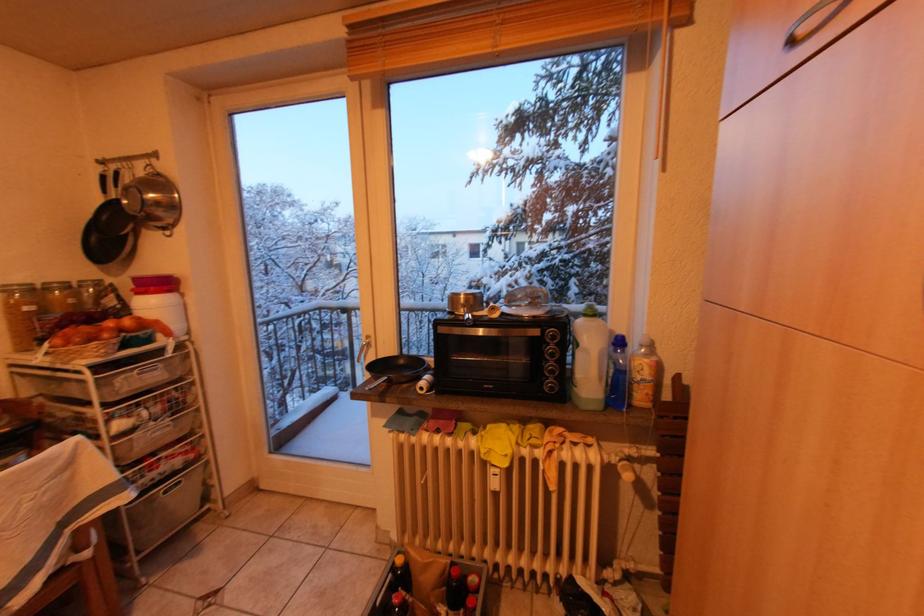
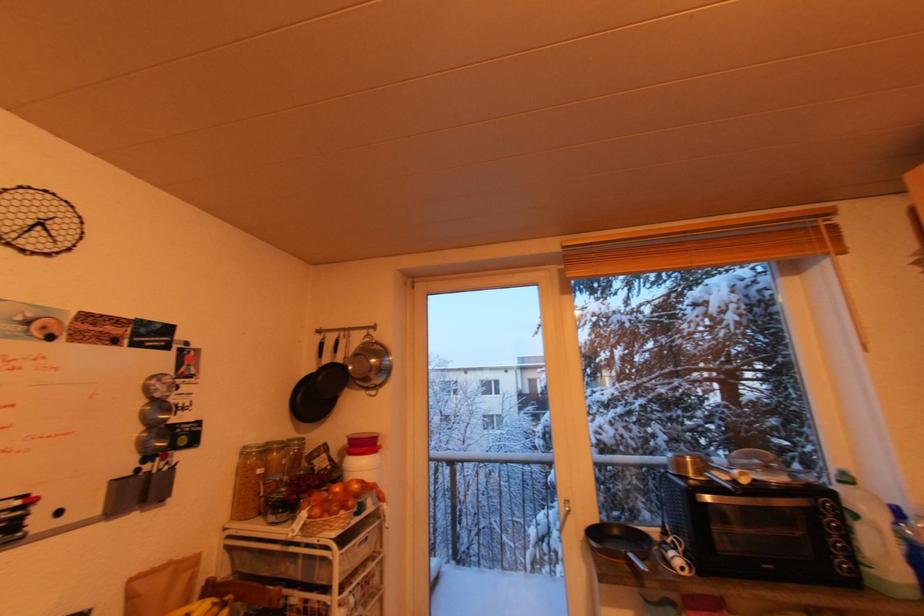
Question: What movement of the cameraman would produce the second image?

Choices:
 (A) Left
 (B) Right
 (C) Forward
 (D) Backward

Answer: (A)